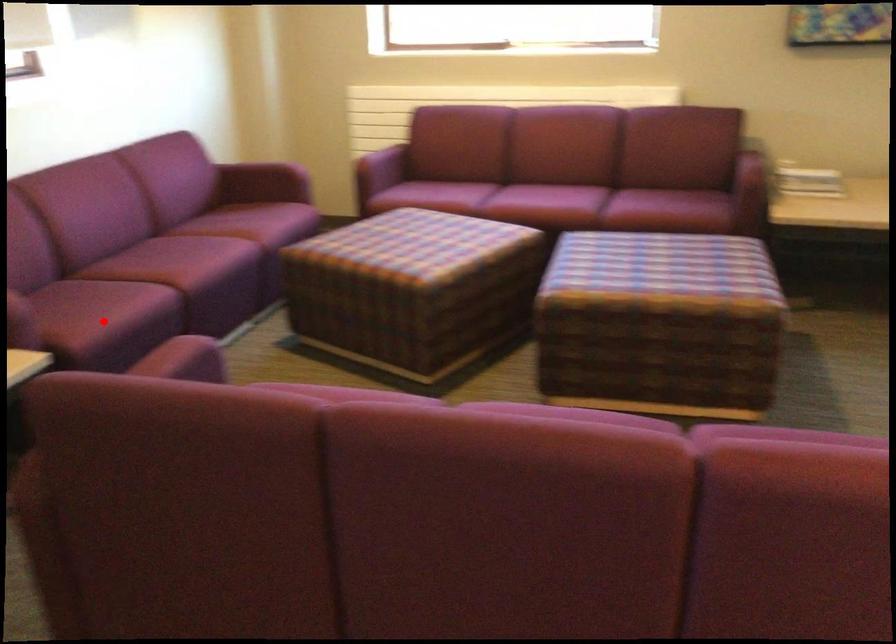
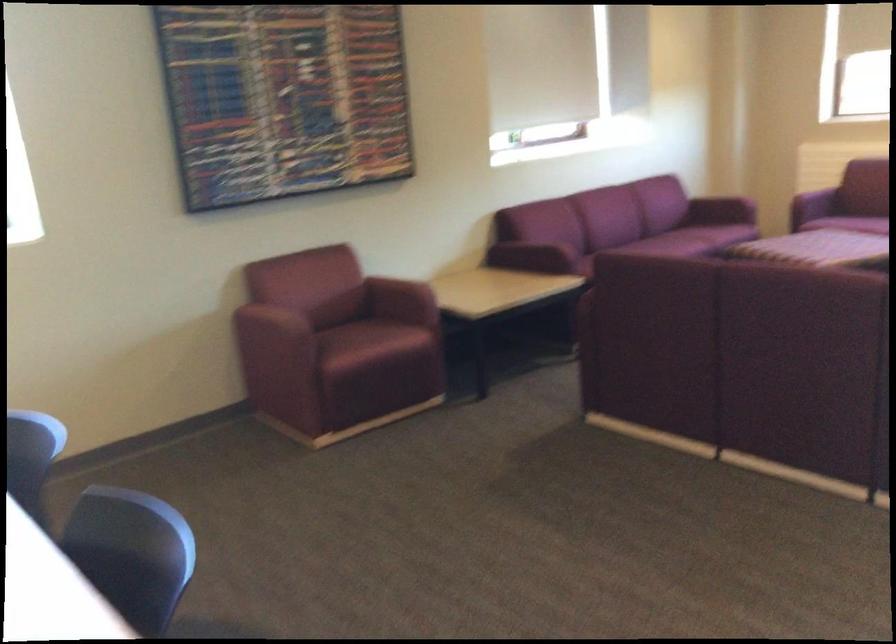
Question: I am providing you with two images of the same scene from different viewpoints. A red point is marked on the first image. Can you still see the location of the red point in image 2?

Choices:
 (A) Yes
 (B) No

Answer: (B)